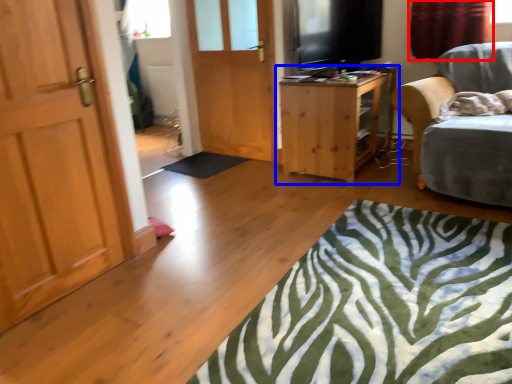
Question: Which object appears closest to the camera in this image, curtain (highlighted by a red box) or table (highlighted by a blue box)?

Choices:
 (A) curtain
 (B) table

Answer: (B)